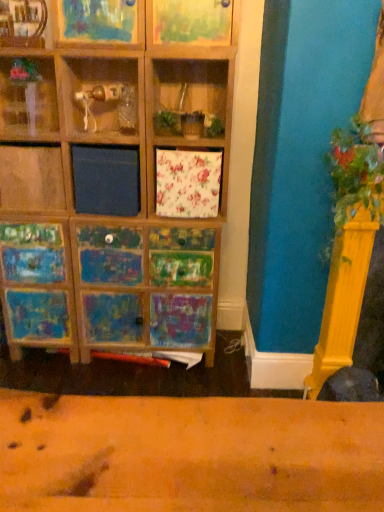
Question: Would you say green leafy plant at right is inside or outside wooden frame at upper center, which is the third shelf in left-to-right order?

Choices:
 (A) outside
 (B) inside

Answer: (A)

Question: In the image, is green leafy plant at right positioned in front of or behind wooden frame at upper center, arranged as the first shelf when viewed from the right?

Choices:
 (A) behind
 (B) front

Answer: (B)

Question: Estimate the real-world distances between objects in this image. Which object is farther from the green leafy plant at right?

Choices:
 (A) wooden shelf at upper left, positioned as the second shelf in left-to-right order
 (B) clear glass vase at upper left, the first shelf viewed from the left
 (C) wooden frame at upper center, arranged as the first shelf when viewed from the right

Answer: (A)

Question: Estimate the real-world distances between objects in this image. Which object is farther from the wooden shelf at upper left, positioned as the second shelf in left-to-right order?

Choices:
 (A) wooden frame at upper center, which is the third shelf in left-to-right order
 (B) clear glass vase at upper left, arranged as the third shelf when viewed from the right
 (C) green leafy plant at right

Answer: (C)